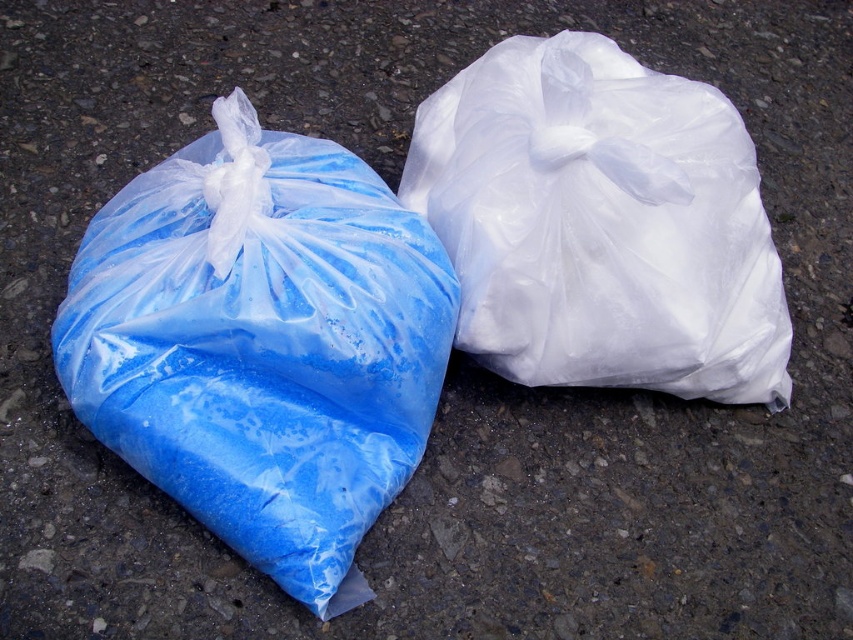
Question: Considering the relative positions of blue translucent bag at left and white translucent bag at right in the image provided, where is blue translucent bag at left located with respect to white translucent bag at right?

Choices:
 (A) right
 (B) left

Answer: (B)

Question: Which object appears farthest from the camera in this image?

Choices:
 (A) white translucent bag at right
 (B) blue translucent bag at left

Answer: (A)

Question: From the image, what is the correct spatial relationship of blue translucent bag at left in relation to white translucent bag at right?

Choices:
 (A) left
 (B) right

Answer: (A)

Question: Does blue translucent bag at left come behind white translucent bag at right?

Choices:
 (A) yes
 (B) no

Answer: (B)

Question: Which point is closer to the camera?

Choices:
 (A) (685, 349)
 (B) (234, 227)

Answer: (B)

Question: Which of the following is the closest to the observer?

Choices:
 (A) (374, 298)
 (B) (573, 316)

Answer: (A)